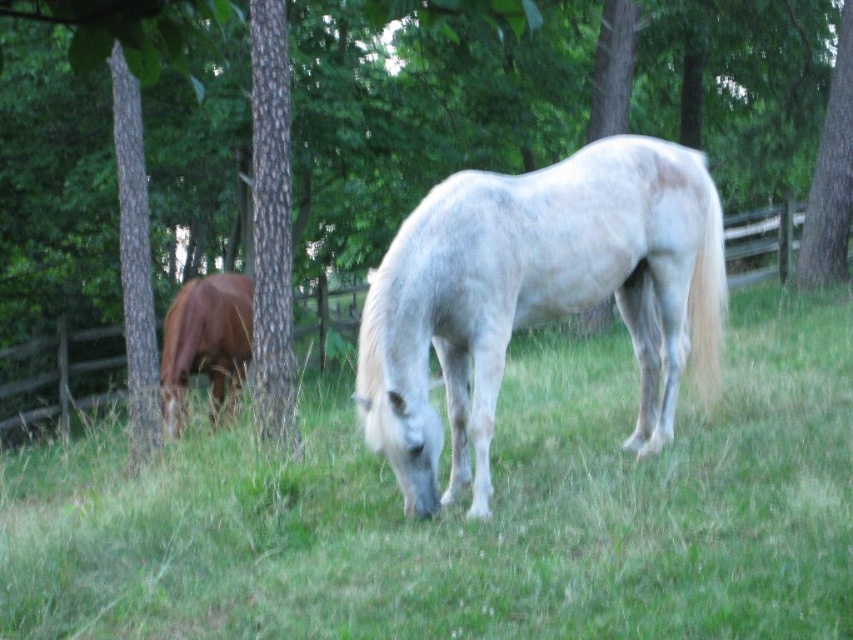
Can you confirm if green grass at center is positioned to the right of smooth bark tree trunk at left?

Yes, green grass at center is to the right of smooth bark tree trunk at left.

The width and height of the screenshot is (853, 640). What do you see at coordinates (471, 522) in the screenshot? I see `green grass at center` at bounding box center [471, 522].

Where is `green grass at center`? This screenshot has height=640, width=853. green grass at center is located at coordinates (471, 522).

I want to click on green grass at center, so click(x=471, y=522).

Who is positioned more to the right, green grass at center or brown glossy horse at left?

green grass at center

Is point (769, 609) positioned in front of point (213, 374)?

Yes.

Locate an element on the screen. green grass at center is located at coordinates (471, 522).

Is green bark tree at center below white matte horse at center?

Incorrect, green bark tree at center is not positioned below white matte horse at center.

Can you confirm if green bark tree at center is shorter than white matte horse at center?

In fact, green bark tree at center may be taller than white matte horse at center.

Is point (163, 88) more distant than point (577, 234)?

Yes, it is.

I want to click on green bark tree at center, so click(421, 109).